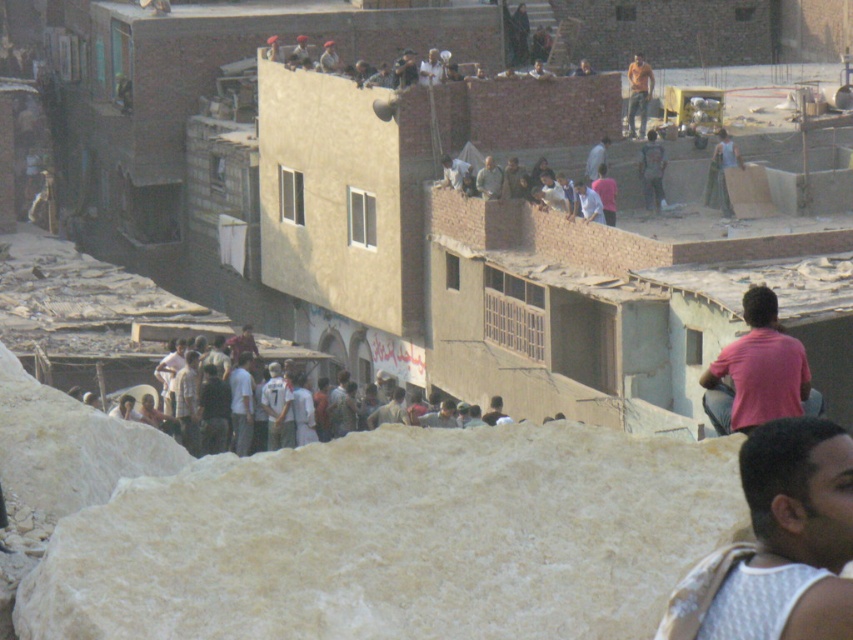
Is point (740, 627) closer to viewer compared to point (775, 300)?

Yes.

Which is more to the left, white textured shirt at lower right or pink cotton shirt at right?

Positioned to the left is white textured shirt at lower right.

The width and height of the screenshot is (853, 640). Find the location of `white textured shirt at lower right`. white textured shirt at lower right is located at coordinates (779, 545).

Image resolution: width=853 pixels, height=640 pixels. In order to click on white textured shirt at lower right in this screenshot , I will do tap(779, 545).

Which is behind, point (386, 403) or point (634, 128)?

Point (634, 128)

Who is lower down, white cotton shirt at lower left or orange t-shirt at upper center?

white cotton shirt at lower left is lower down.

You are a GUI agent. You are given a task and a screenshot of the screen. Output one action in this format:
    pyautogui.click(x=<x>, y=<y>)
    Task: Click on the white cotton shirt at lower left
    This screenshot has width=853, height=640.
    Given the screenshot: What is the action you would take?
    pyautogui.click(x=407, y=417)

From the picture: Between white textured shirt at lower right and white cotton shirt at lower left, which one is positioned lower?

white textured shirt at lower right is lower down.

Is point (805, 636) farther from camera compared to point (279, 381)?

No, it is in front of (279, 381).

Where is `white textured shirt at lower right`? This screenshot has width=853, height=640. white textured shirt at lower right is located at coordinates (779, 545).